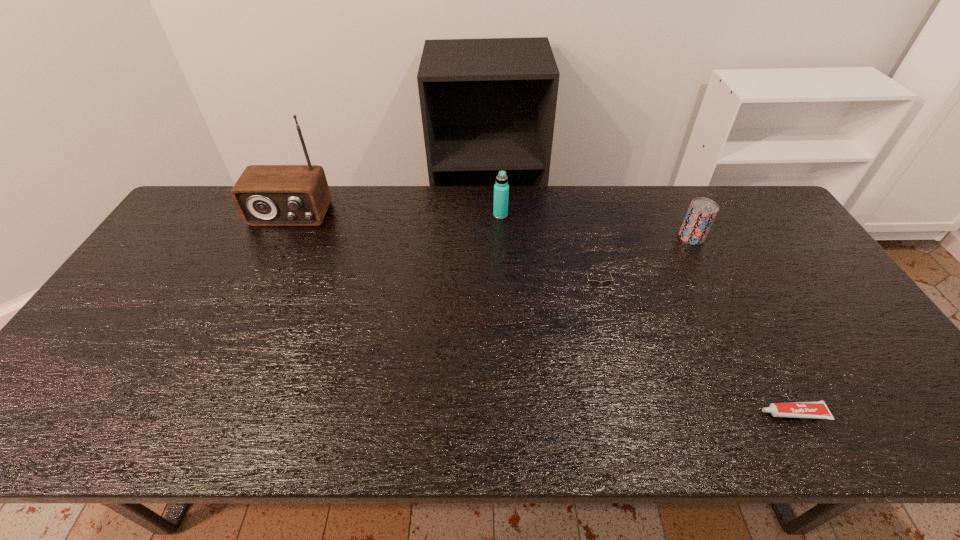
Identify the location of the leftmost object. This screenshot has width=960, height=540. (265, 195).

Where is `radio receiver`? radio receiver is located at coordinates (265, 195).

Find the location of a particular element. the second tallest object is located at coordinates (501, 189).

This screenshot has width=960, height=540. Identify the location of the fourth object from right to left. (501, 189).

Find the location of a particular element. This screenshot has height=540, width=960. beer can is located at coordinates (701, 213).

Find the location of a particular element. the fourth farthest object is located at coordinates (592, 282).

In order to click on the second shortest object in this screenshot , I will do `click(592, 282)`.

Where is `the shortest object`? This screenshot has height=540, width=960. the shortest object is located at coordinates (817, 409).

Identify the location of the nearest object. (817, 409).

Image resolution: width=960 pixels, height=540 pixels. In order to click on vacant space located 0.360m on the front-facing side of the tallest object in this screenshot , I will do `click(241, 316)`.